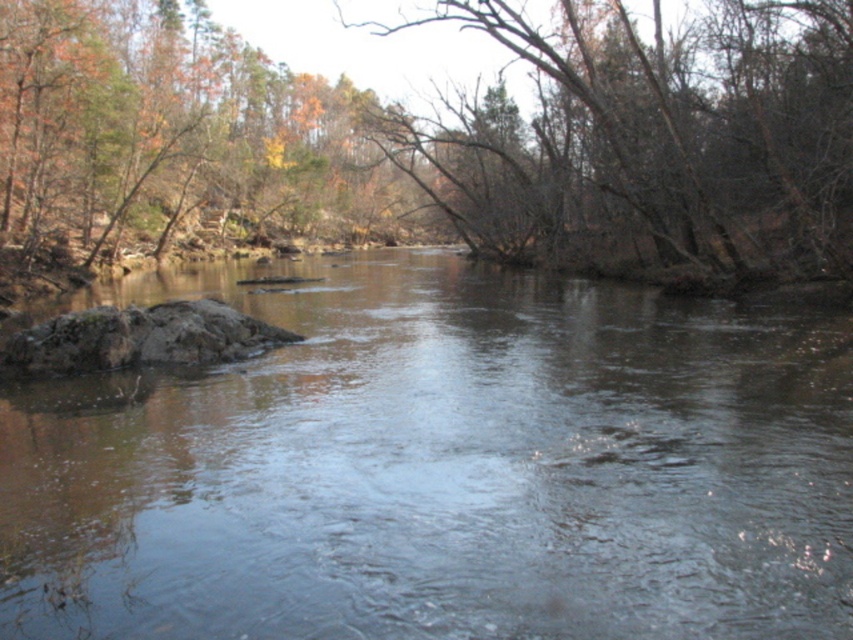
You are standing at the center of the river and want to reach the brown smooth rock at left. Which direction should you move in to get there?

The brown smooth rock at left is located at point [440,467], so you should move to the left to reach it.

You are standing at the center of the river in the image. Looking towards the upper right corner, can you tell me the exact 2D coordinates of the brown bark tree at upper right?

The brown bark tree at upper right is located at the 2D coordinates of point (653,141).